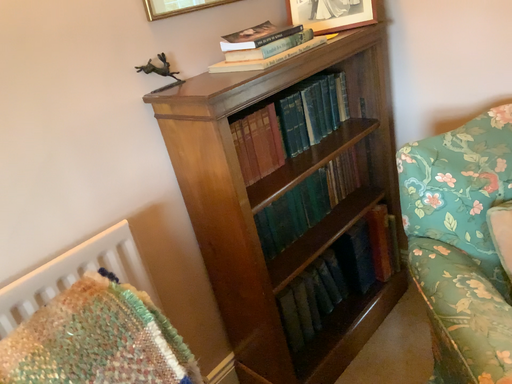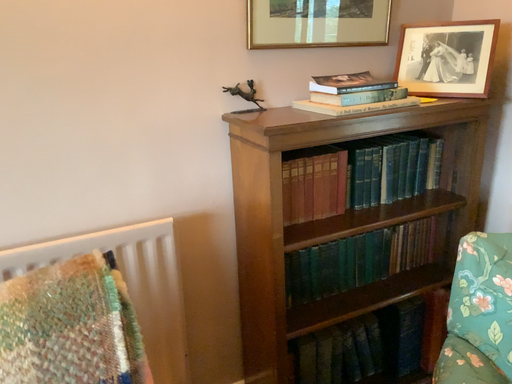
Question: Which way did the camera rotate in the video?

Choices:
 (A) rotated right
 (B) rotated left

Answer: (B)